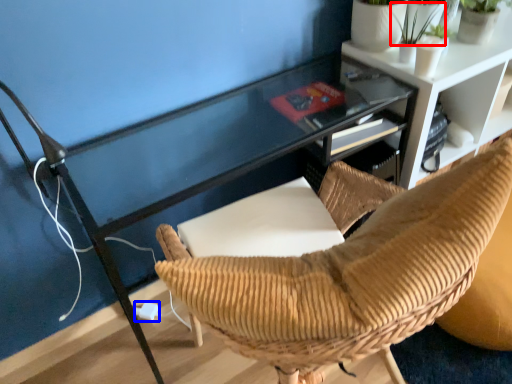
Question: Which point is closer to the camera, plant (highlighted by a red box) or plug (highlighted by a blue box)?

Choices:
 (A) plant
 (B) plug

Answer: (A)